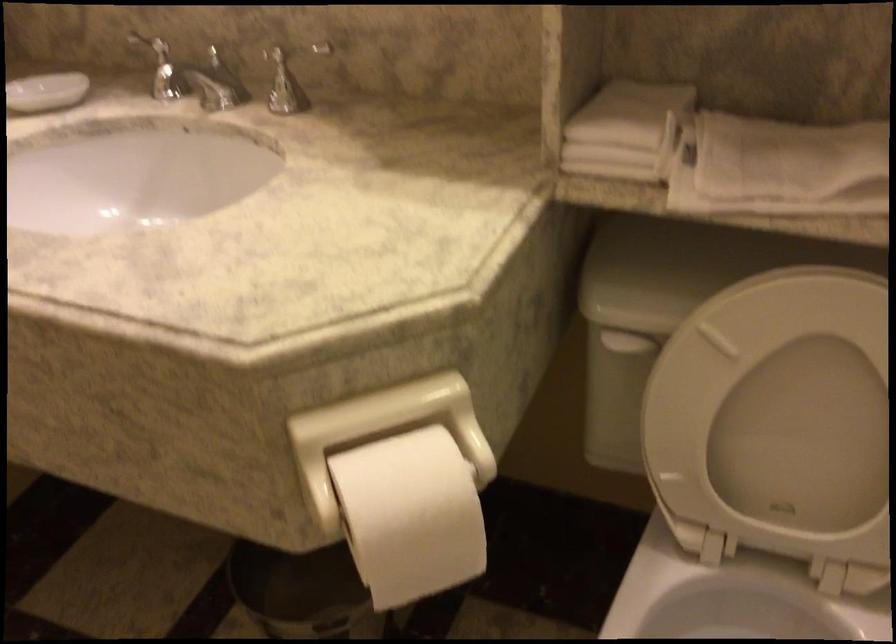
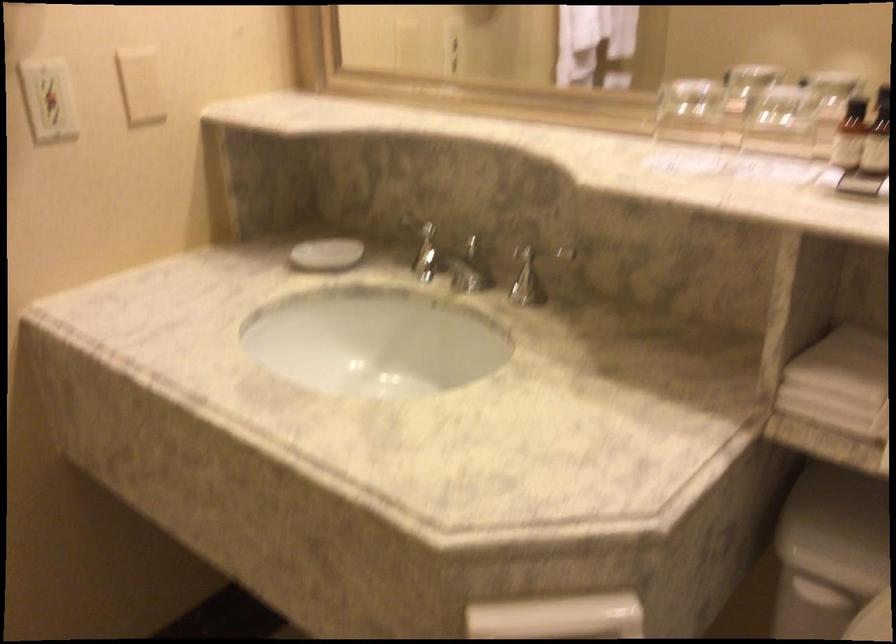
Question: The images are taken continuously from a first-person perspective. In which direction are you moving?

Choices:
 (A) Left
 (B) Right
 (C) Forward
 (D) Backward

Answer: (D)